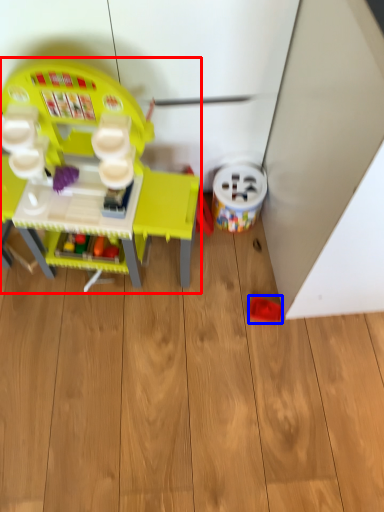
Question: Which of the following is the farthest to the observer, toy (highlighted by a red box) or toy (highlighted by a blue box)?

Choices:
 (A) toy
 (B) toy

Answer: (B)